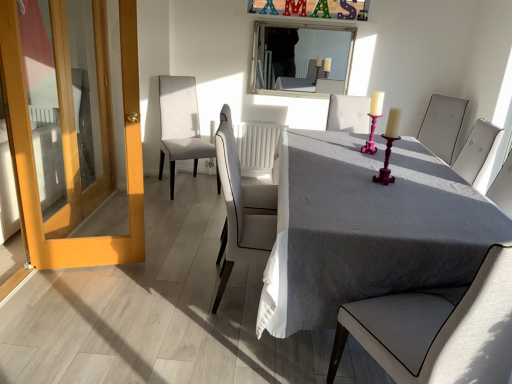
Question: From a real-world perspective, relative to light beige fabric chair at center, which ranks as the 5th chair in front-to-back order, is matte white chair at center, which is the 4th chair from left to right, vertically above or below?

Choices:
 (A) below
 (B) above

Answer: (B)

Question: In terms of height, does matte white chair at center, the second chair positioned from the right, look taller or shorter compared to light beige fabric chair at center, which is counted as the 1th chair, starting from the left?

Choices:
 (A) tall
 (B) short

Answer: (B)

Question: Which object is positioned closest to the light gray fabric chair at center, which is the 1th chair in front-to-back order?

Choices:
 (A) light beige fabric chair at center, which is counted as the 1th chair, starting from the left
 (B) wooden door at left
 (C) white leather chair at center, which is counted as the fourth chair, starting from the back
 (D) gray fabric table at center
 (E) white framed mirror at upper center

Answer: (D)

Question: Which object is the farthest from the wooden door at left?

Choices:
 (A) white framed mirror at upper center
 (B) white leather chair at center, which appears as the second chair when viewed from the left
 (C) gray fabric table at center
 (D) light beige fabric chair at center, acting as the first chair starting from the back
 (E) matte white chair at center, the second chair positioned from the right

Answer: (A)